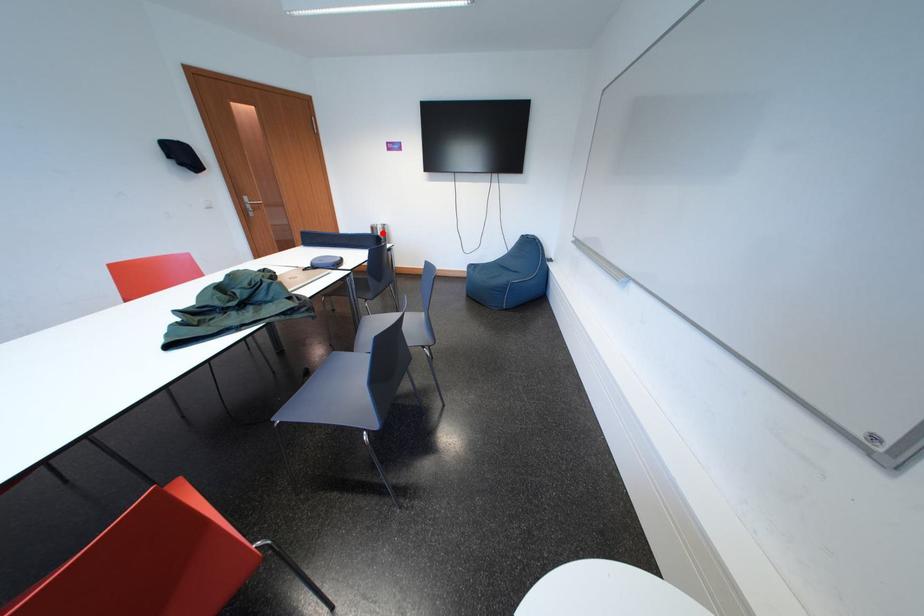
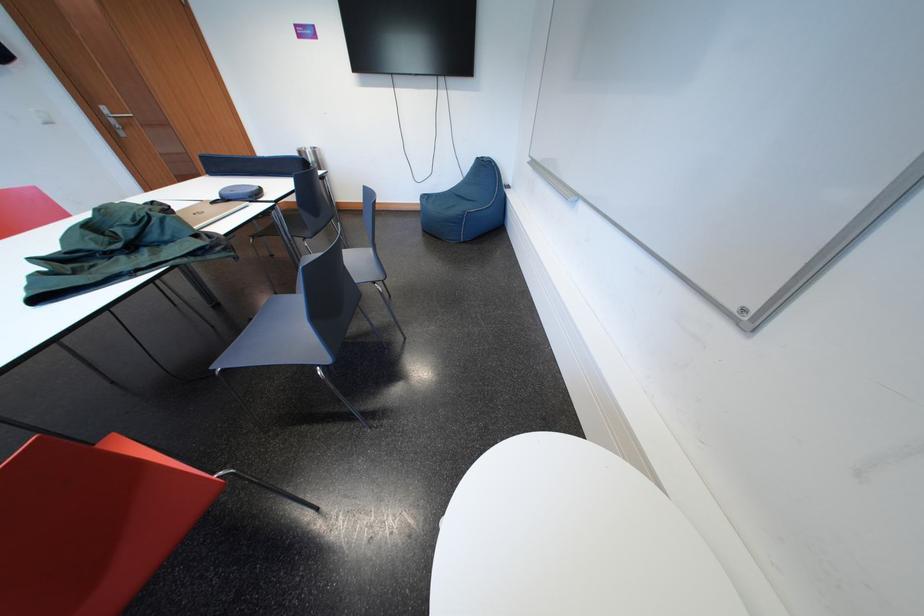
Question: I am providing you with two images of the same scene from different viewpoints. A red point is marked on the first image. Is the red point's position out of view in image 2?

Choices:
 (A) Yes
 (B) No

Answer: (B)